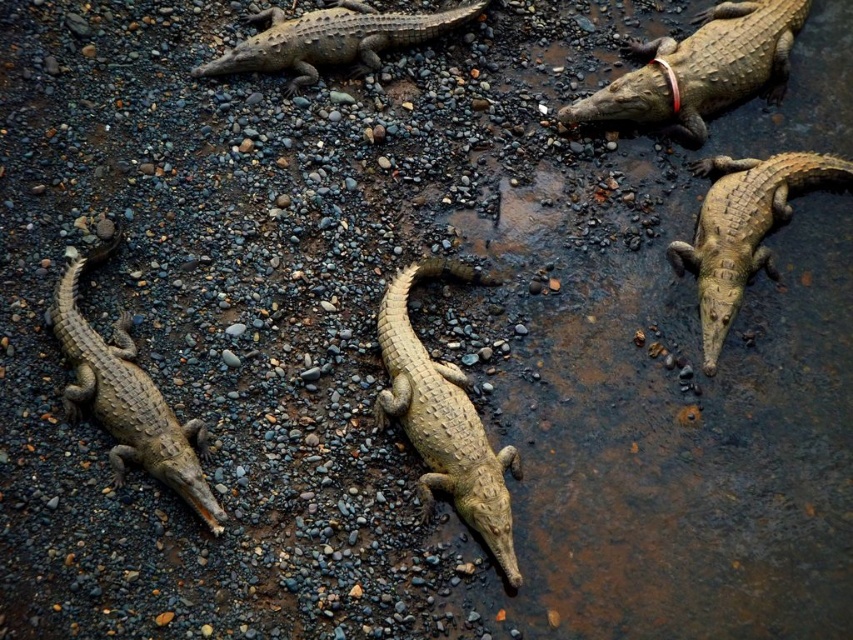
Which of these two, leathery brown crocodile at lower left or smooth brown crocodile at center, stands shorter?

With less height is smooth brown crocodile at center.

This screenshot has height=640, width=853. I want to click on leathery brown crocodile at lower left, so click(x=128, y=397).

Find the location of a particular element. This screenshot has height=640, width=853. leathery brown crocodile at lower left is located at coordinates (128, 397).

Consider the image. Between smooth tan crocodile at center and light brown textured skin at upper right, which one is positioned higher?

light brown textured skin at upper right

At what (x,y) coordinates should I click in order to perform the action: click on smooth tan crocodile at center. Please return your answer as a coordinate pair (x, y). Image resolution: width=853 pixels, height=640 pixels. Looking at the image, I should click on (444, 419).

Locate an element on the screen. Image resolution: width=853 pixels, height=640 pixels. smooth tan crocodile at center is located at coordinates (444, 419).

Who is positioned more to the right, smooth tan crocodile at center or leathery brown crocodile at lower left?

smooth tan crocodile at center is more to the right.

In the scene shown: Does smooth tan crocodile at center appear on the right side of leathery brown crocodile at lower left?

Correct, you'll find smooth tan crocodile at center to the right of leathery brown crocodile at lower left.

The image size is (853, 640). I want to click on smooth tan crocodile at center, so [x=444, y=419].